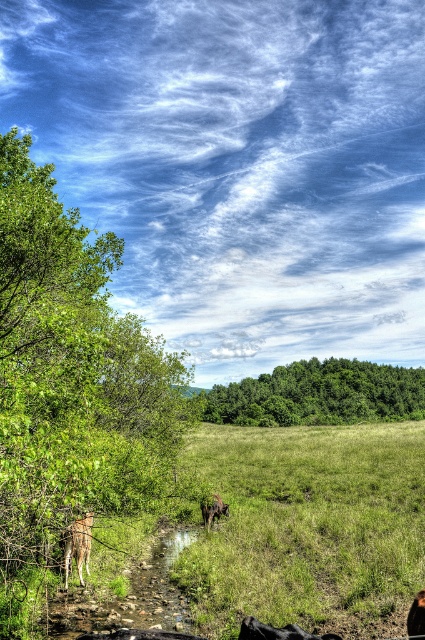
Measure the distance from brown fur deer at left to brown furry cow at center.

They are 8.03 meters apart.

Does point (82, 580) lie behind point (215, 500)?

No, (82, 580) is in front of (215, 500).

Identify the location of brown fur deer at left. The image size is (425, 640). (76, 545).

Who is positioned more to the right, green leafy trees at center or brown furry dog at lower right?

green leafy trees at center

Which is behind, point (416, 392) or point (419, 618)?

The point (416, 392) is behind.

Does point (342, 390) lie in front of point (413, 605)?

No.

The height and width of the screenshot is (640, 425). Find the location of `green leafy trees at center`. green leafy trees at center is located at coordinates (320, 394).

Does point (57, 298) come closer to viewer compared to point (201, 513)?

Yes, it is in front of point (201, 513).

Who is more forward, (x=20, y=403) or (x=215, y=496)?

Positioned in front is point (x=20, y=403).

Which is behind, point (11, 408) or point (206, 524)?

Point (206, 524)

Find the location of `green leafy tree at left`. green leafy tree at left is located at coordinates (71, 372).